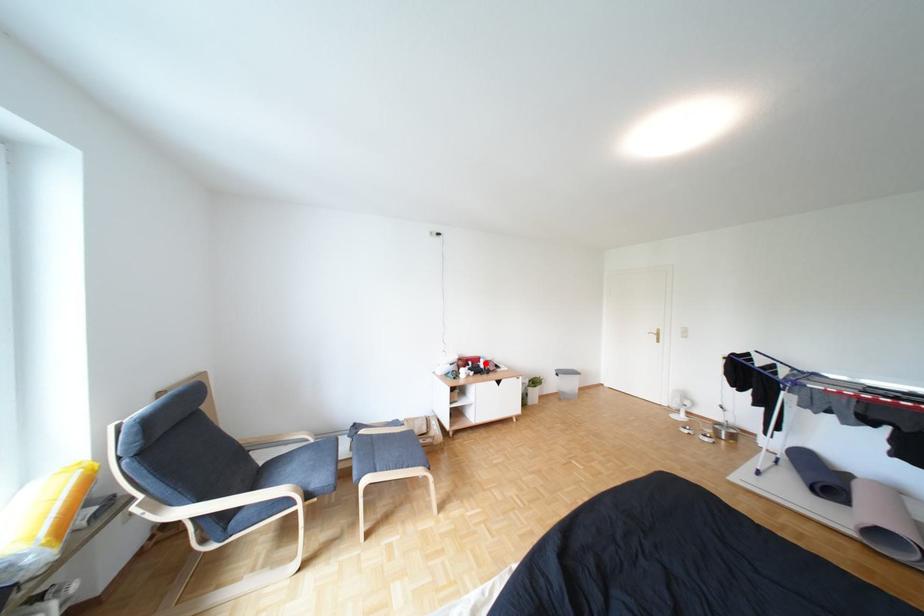
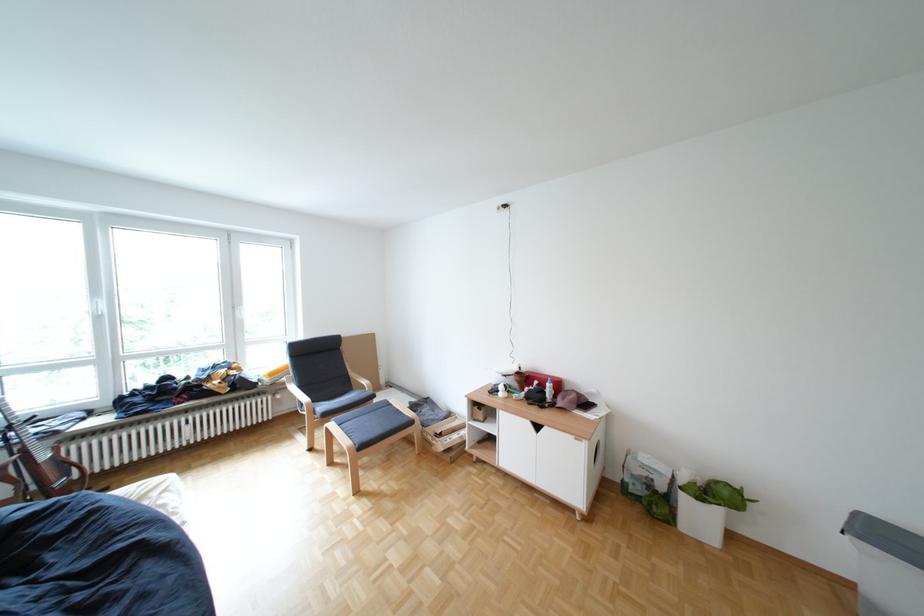
The point at the highlighted location is marked in the first image. Where is the corresponding point in the second image?

(552, 383)